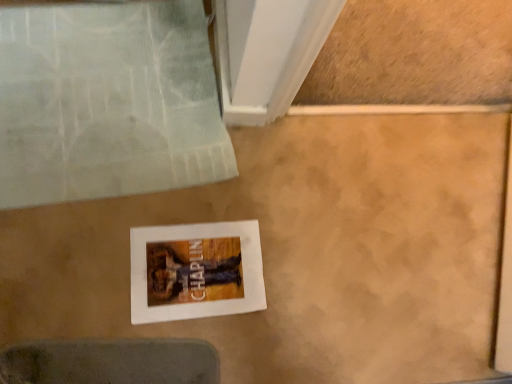
In order to face white sheer fabric at upper left, should I rotate leftwards or rightwards?

To face it directly, rotate left by 18.581 degrees.

This screenshot has height=384, width=512. Find the location of `white sheer fabric at upper left`. white sheer fabric at upper left is located at coordinates (106, 102).

What do you see at coordinates (106, 102) in the screenshot? Image resolution: width=512 pixels, height=384 pixels. I see `white sheer fabric at upper left` at bounding box center [106, 102].

Locate an element on the screen. white sheer fabric at upper left is located at coordinates (106, 102).